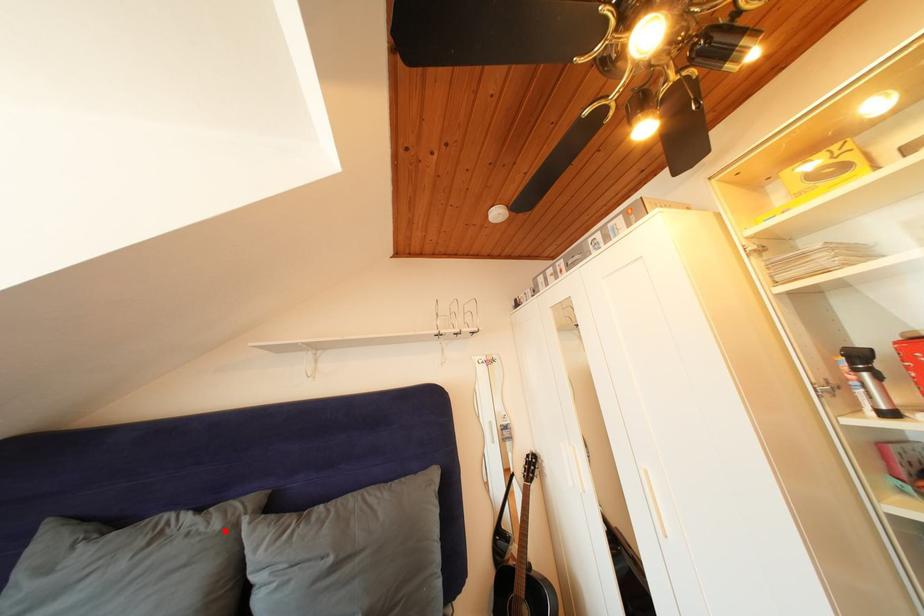
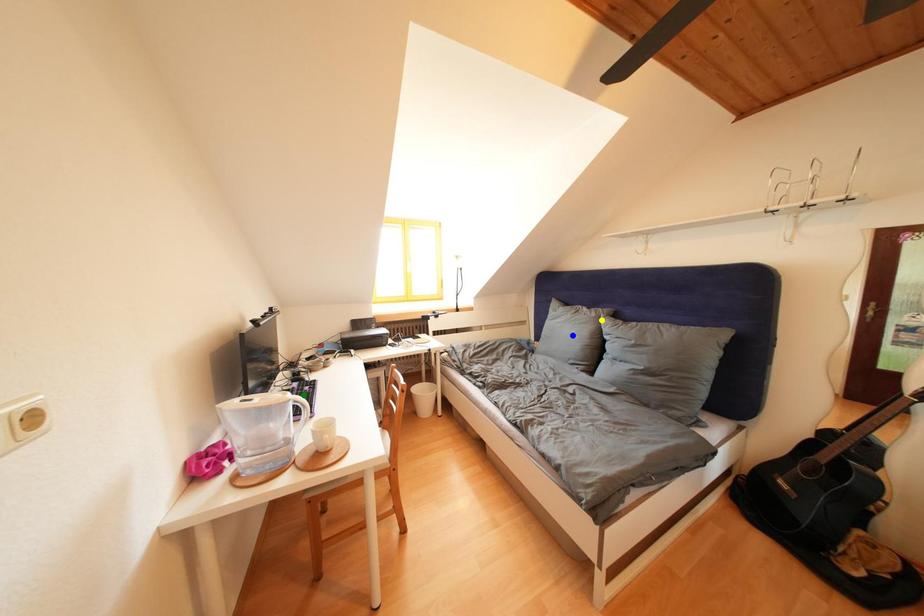
Question: I am providing you with two images of the same scene from different viewpoints. A red point is marked on the first image. You are given multiple points on the second image. In image 2, which mark is for the same physical point as the one in image 1?

Choices:
 (A) blue point
 (B) yellow point
 (C) green point

Answer: (B)